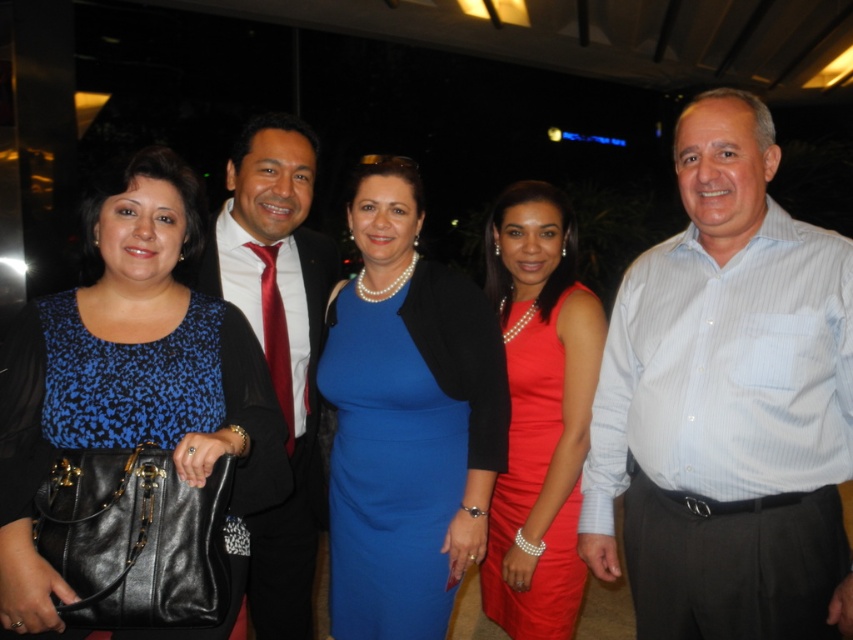
Who is taller, white striped shirt at center or shiny red dress at center?

Standing taller between the two is shiny red dress at center.

Can you confirm if white striped shirt at center is taller than shiny red dress at center?

In fact, white striped shirt at center may be shorter than shiny red dress at center.

You are a GUI agent. You are given a task and a screenshot of the screen. Output one action in this format:
    pyautogui.click(x=<x>, y=<y>)
    Task: Click on the white striped shirt at center
    The height and width of the screenshot is (640, 853).
    Given the screenshot: What is the action you would take?
    pyautogui.click(x=727, y=403)

Which is in front, point (335, 568) or point (572, 484)?

Point (572, 484)

Consider the image. Is royal blue satin dress at center to the right of shiny red dress at center from the viewer's perspective?

In fact, royal blue satin dress at center is to the left of shiny red dress at center.

Locate an element on the screen. Image resolution: width=853 pixels, height=640 pixels. royal blue satin dress at center is located at coordinates (392, 460).

Can you confirm if white striped shirt at center is thinner than shiny red tie at center?

Incorrect, white striped shirt at center's width is not less than shiny red tie at center's.

This screenshot has height=640, width=853. What are the coordinates of `white striped shirt at center` in the screenshot? It's located at (727, 403).

I want to click on white striped shirt at center, so click(x=727, y=403).

The image size is (853, 640). I want to click on white striped shirt at center, so click(x=727, y=403).